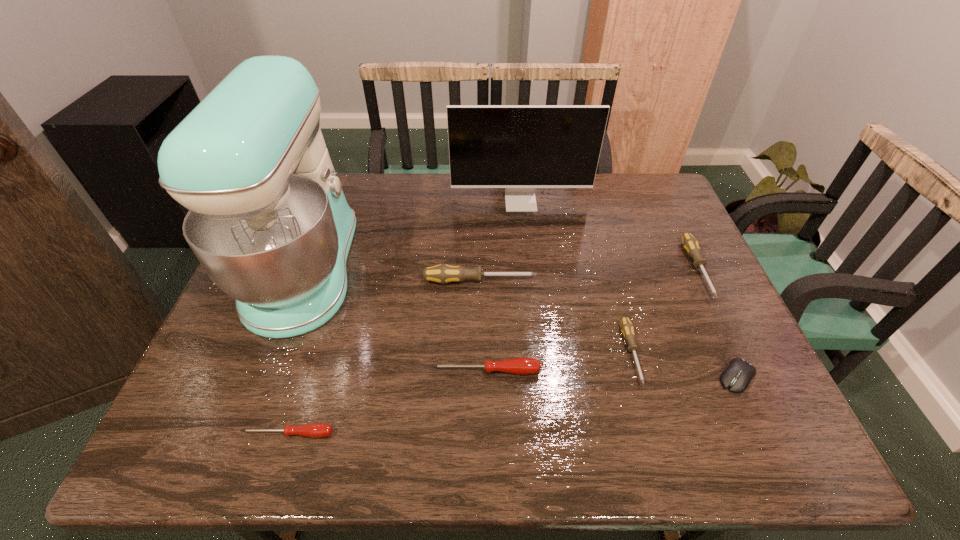
Where is `free region located 0.110m at the tip of the smallest gray screwdriver`? The image size is (960, 540). free region located 0.110m at the tip of the smallest gray screwdriver is located at coordinates (656, 438).

The image size is (960, 540). In order to click on vacant position located on the back of the computer equipment in this screenshot , I will do pyautogui.click(x=687, y=269).

The width and height of the screenshot is (960, 540). I want to click on vacant space situated on the back of the left red screwdriver, so click(327, 308).

Where is `mixer located at the far edge`? The image size is (960, 540). mixer located at the far edge is located at coordinates (268, 220).

Where is `monitor that is at the far edge`? The image size is (960, 540). monitor that is at the far edge is located at coordinates (517, 147).

Locate an element on the screen. object present at the near edge is located at coordinates (315, 430).

Find the location of `mixer at the left edge`. mixer at the left edge is located at coordinates (268, 220).

Identify the location of screwdriver that is positioned at the left edge. This screenshot has height=540, width=960. (315, 430).

Image resolution: width=960 pixels, height=540 pixels. I want to click on screwdriver that is positioned at the right edge, so click(690, 244).

This screenshot has width=960, height=540. I want to click on computer equipment present at the right edge, so click(737, 376).